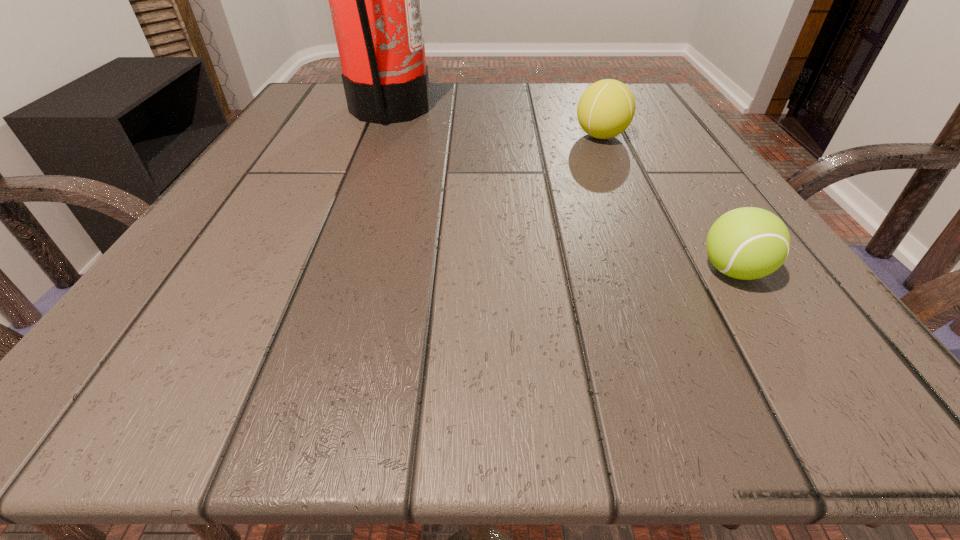
Identify the location of the tallest object. (375, 0).

This screenshot has width=960, height=540. In order to click on fire extinguisher in this screenshot , I will do tap(375, 0).

The width and height of the screenshot is (960, 540). What are the coordinates of `the farther tennis ball` in the screenshot? It's located at (606, 108).

Where is `the nearest object`? the nearest object is located at coordinates (747, 243).

Image resolution: width=960 pixels, height=540 pixels. Identify the location of the shortest object. (747, 243).

Find the location of a particular element. vacant area situated on the front side of the leftmost object is located at coordinates (552, 111).

Locate an element on the screen. The height and width of the screenshot is (540, 960). vacant region located 0.090m on the right of the farther tennis ball is located at coordinates (677, 136).

Identify the location of free region located on the left of the shorter tennis ball. The width and height of the screenshot is (960, 540). (610, 271).

Locate an element on the screen. This screenshot has height=540, width=960. fire extinguisher that is at the far edge is located at coordinates (375, 0).

At what (x,y) coordinates should I click in order to perform the action: click on tennis ball present at the far edge. Please return your answer as a coordinate pair (x, y). Looking at the image, I should click on (606, 108).